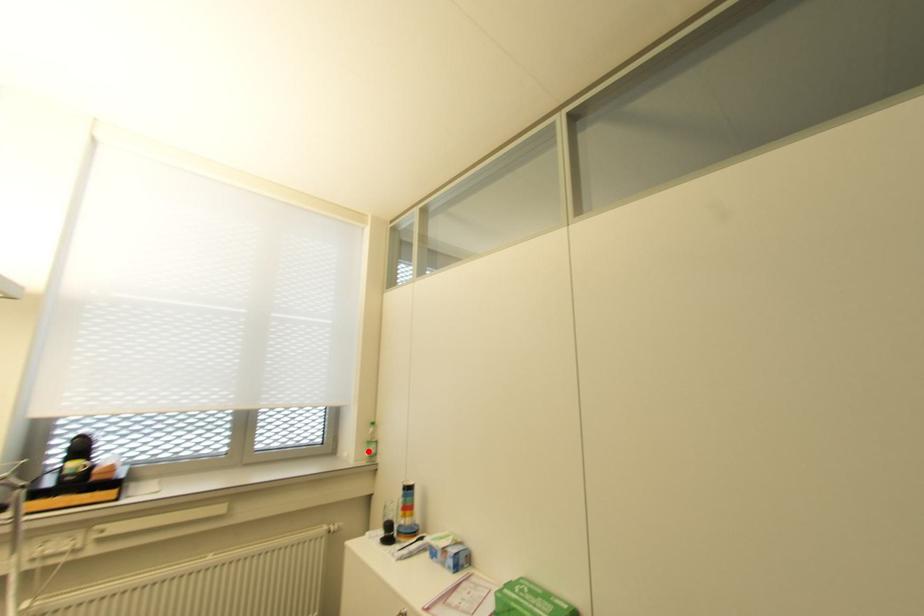
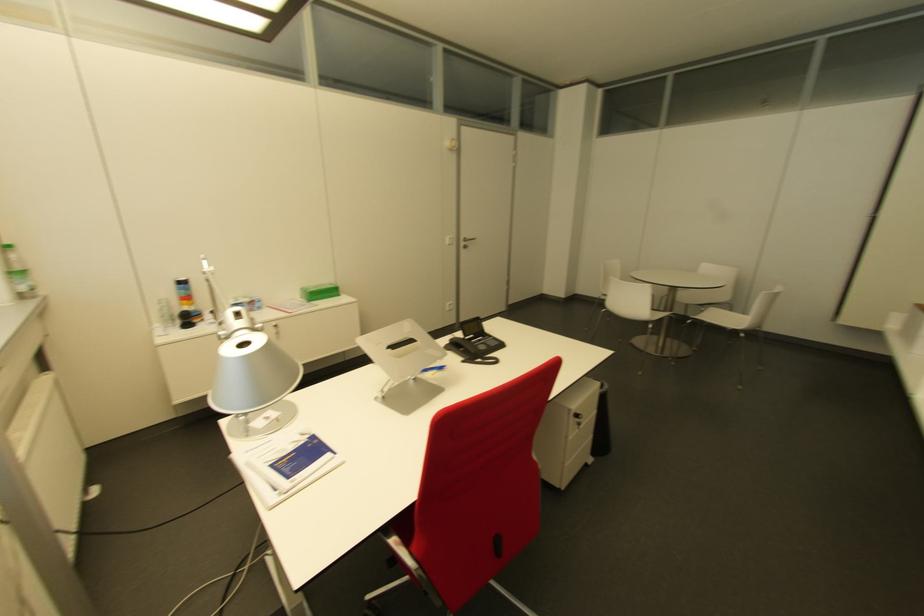
Find the pixel in the second image that matches the highlighted location in the first image.

(27, 284)